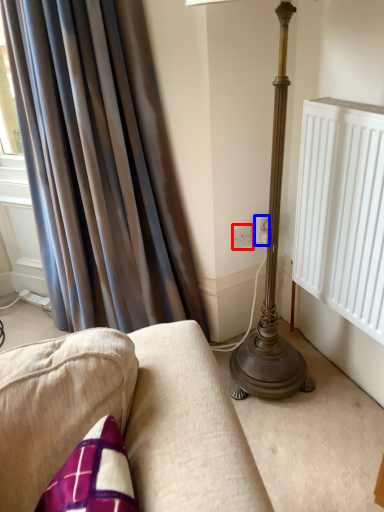
Question: Which point is closer to the camera, electric outlet (highlighted by a red box) or electric outlet (highlighted by a blue box)?

Choices:
 (A) electric outlet
 (B) electric outlet

Answer: (B)